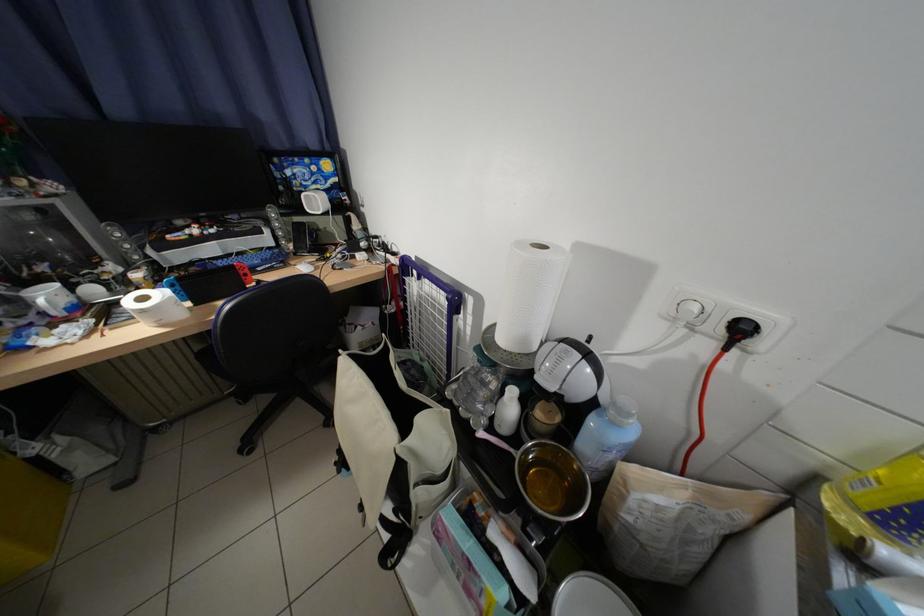
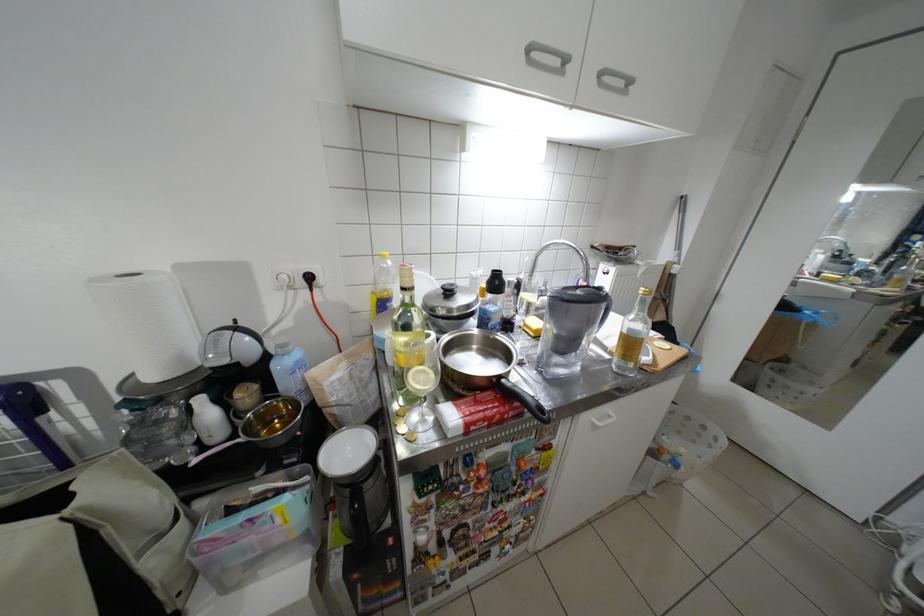
Find the pixel in the second image that matches [514,341] in the first image.

(164, 378)